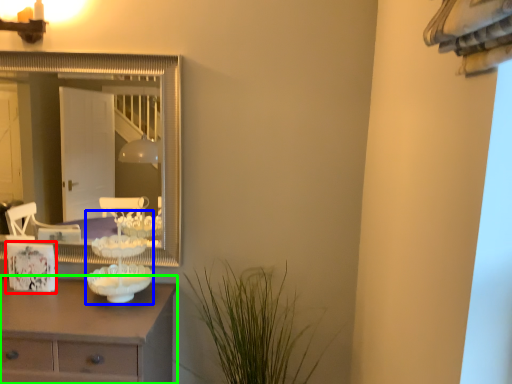
Question: Which object is positioned farthest from picture frame (highlighted by a red box)? Select from candle holder (highlighted by a blue box) and chest of drawers (highlighted by a green box).

Choices:
 (A) candle holder
 (B) chest of drawers

Answer: (B)